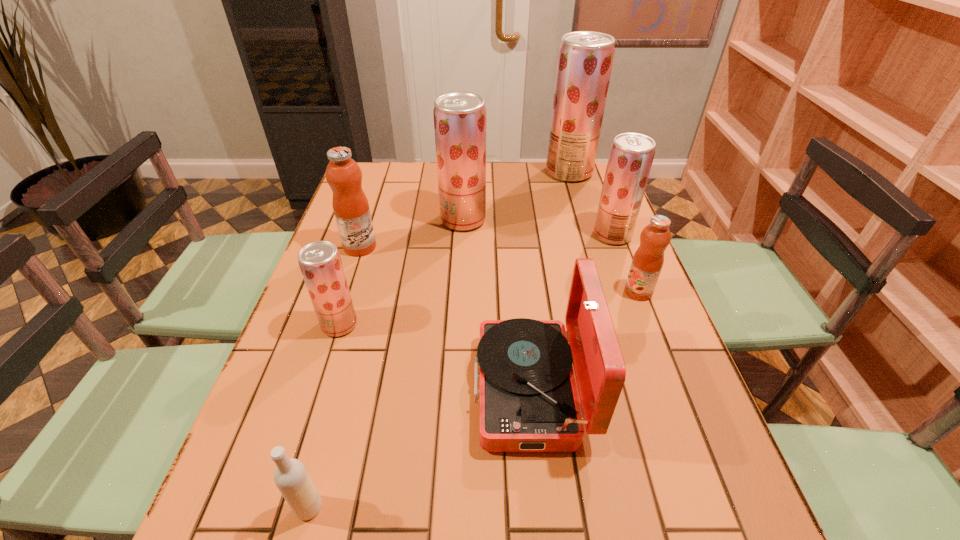
Identify the location of free spot located on the front-facing side of the phonograph_record. The height and width of the screenshot is (540, 960). (342, 389).

Where is `free region located on the back of the nearest strawberry fruit juice`? Image resolution: width=960 pixels, height=540 pixels. free region located on the back of the nearest strawberry fruit juice is located at coordinates (366, 243).

This screenshot has height=540, width=960. I want to click on free region located 0.190m on the front label of the smaller orange fruit juice, so click(x=551, y=292).

This screenshot has height=540, width=960. Find the location of `vacant space located 0.190m on the front label of the smaller orange fruit juice`. vacant space located 0.190m on the front label of the smaller orange fruit juice is located at coordinates (551, 292).

Where is `vacant region located on the front label of the smaller orange fruit juice`? The width and height of the screenshot is (960, 540). vacant region located on the front label of the smaller orange fruit juice is located at coordinates (497, 292).

Image resolution: width=960 pixels, height=540 pixels. I want to click on vacant space situated on the back of the white vodka, so click(324, 455).

You are a GUI agent. You are given a task and a screenshot of the screen. Output one action in this format:
    pyautogui.click(x=<x>, y=<y>)
    Task: Click on the object at the far edge
    Image resolution: width=960 pixels, height=540 pixels.
    Given the screenshot: What is the action you would take?
    pyautogui.click(x=585, y=59)

The width and height of the screenshot is (960, 540). I want to click on vodka at the left edge, so click(291, 477).

Where is `object positioned at the far right corner`? object positioned at the far right corner is located at coordinates (585, 59).

In the image, there is a desktop. At what (x,y) coordinates should I click in order to perform the action: click on free space at the far edge. Please return your answer as a coordinate pair (x, y). Image resolution: width=960 pixels, height=540 pixels. Looking at the image, I should click on (412, 176).